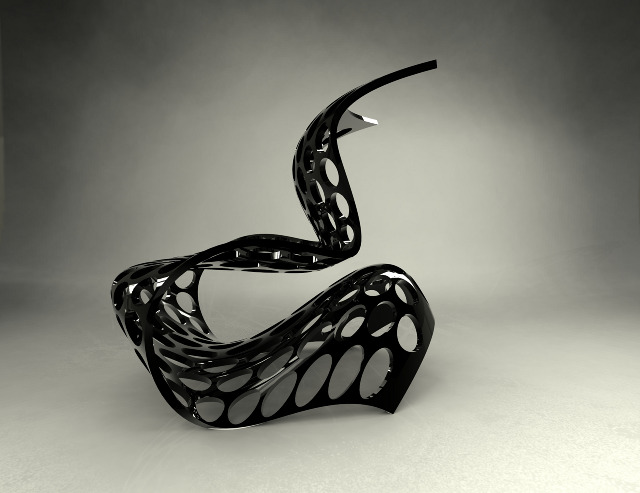
At what (x,y) coordinates should I click in order to perform the action: click on glow of light source. Please return your answer as a coordinate pair (x, y). This screenshot has width=640, height=493. Looking at the image, I should click on (566, 441), (383, 183), (25, 460).